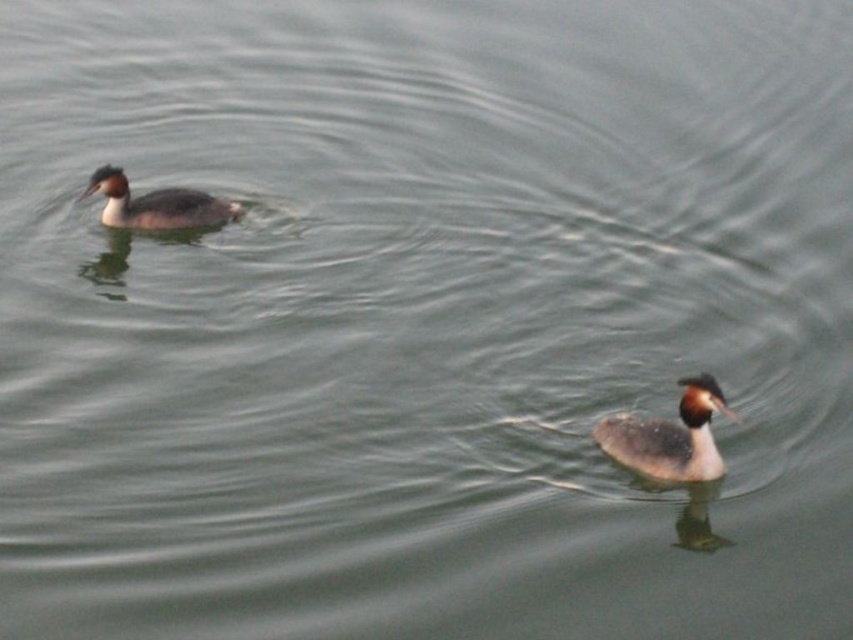
Question: Among these points, which one is farthest from the camera?

Choices:
 (A) (625, 465)
 (B) (144, 227)

Answer: (B)

Question: Does gray speckled duck at lower right have a lesser width compared to gray matte duck at upper left?

Choices:
 (A) no
 (B) yes

Answer: (B)

Question: Among these points, which one is nearest to the camera?

Choices:
 (A) [x=612, y=433]
 (B) [x=164, y=205]

Answer: (A)

Question: Is the position of gray speckled duck at lower right more distant than that of gray matte duck at upper left?

Choices:
 (A) no
 (B) yes

Answer: (A)

Question: Is gray speckled duck at lower right positioned in front of gray matte duck at upper left?

Choices:
 (A) yes
 (B) no

Answer: (A)